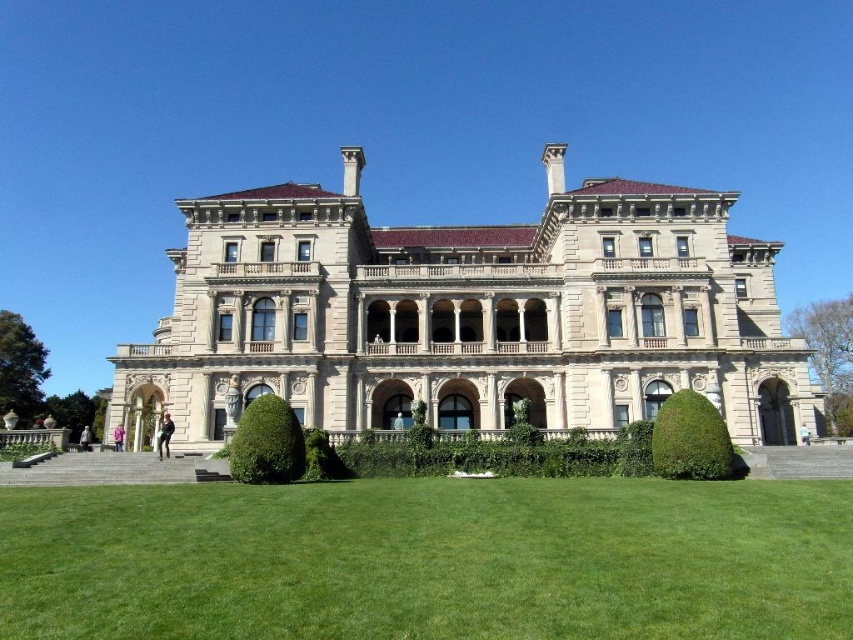
Is point (782, 444) positioned before point (318, 508)?

No.

Is beige stone mansion at center closer to camera compared to green grass at lower center?

No, beige stone mansion at center is further to the viewer.

Which is in front, point (167, 355) or point (161, 612)?

Point (161, 612) is in front.

The width and height of the screenshot is (853, 640). Find the location of `beige stone mansion at center`. beige stone mansion at center is located at coordinates (468, 316).

Does beige stone mansion at center have a larger size compared to green leafy hedge at lower right?

Yes.

Is point (450, 300) farther from viewer compared to point (663, 465)?

Yes.

Find the location of `beige stone mansion at center`. beige stone mansion at center is located at coordinates (468, 316).

Does green grass at lower center have a smaller size compared to green leafy hedge at center?

No.

Between point (22, 600) and point (286, 480), which one is positioned in front?

Point (22, 600)

The image size is (853, 640). In order to click on green grass at lower center in this screenshot , I will do `click(428, 561)`.